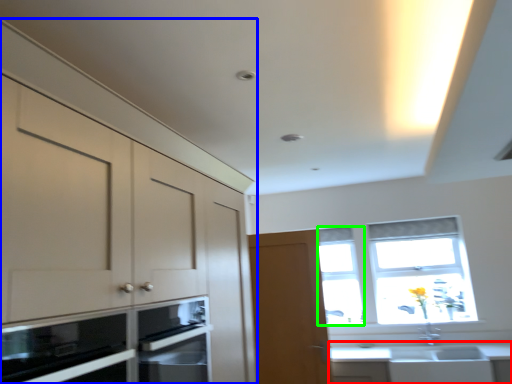
Question: Which is nearer to the countertop (highlighted by a red box)? cabinetry (highlighted by a blue box) or window (highlighted by a green box).

Choices:
 (A) cabinetry
 (B) window

Answer: (B)